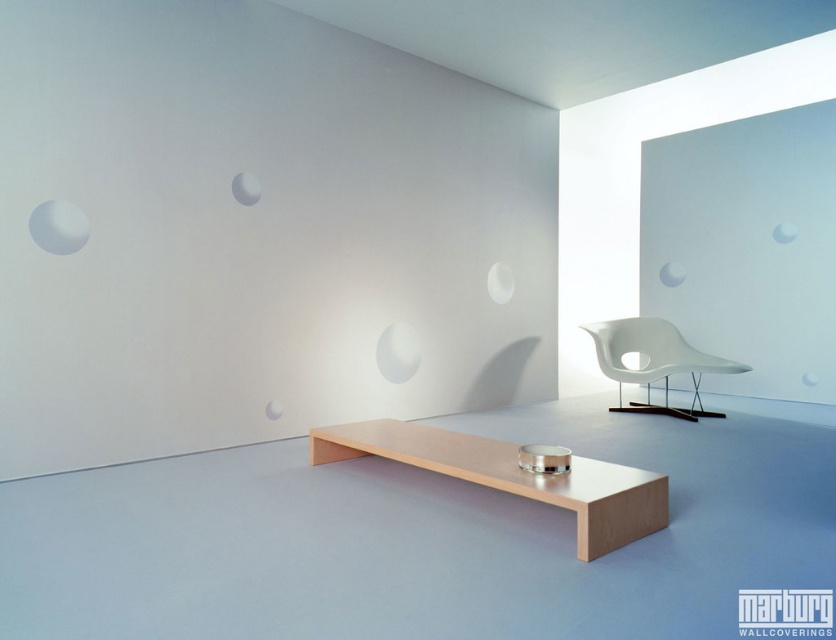
Can you confirm if natural wood stool at center is positioned to the right of white matte armchair at center-right?

No, natural wood stool at center is not to the right of white matte armchair at center-right.

Which is in front, point (630, 490) or point (687, 369)?

Point (630, 490) is more forward.

Which is in front, point (399, 444) or point (646, 321)?

Point (399, 444) is more forward.

Find the location of a particular element. The width and height of the screenshot is (836, 640). natural wood stool at center is located at coordinates (513, 476).